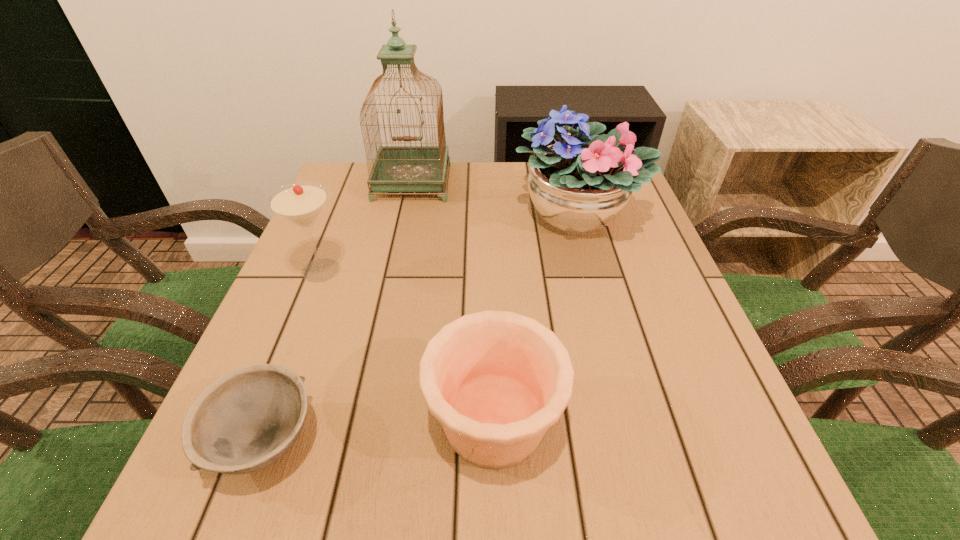
Identify the location of object that is at the far right corner. This screenshot has width=960, height=540. (579, 185).

Identify the location of free space at the far edge. (532, 201).

Identify the location of vacant area at the near edge of the desktop. The height and width of the screenshot is (540, 960). (561, 469).

Identify the location of vacant space at the left edge of the desktop. The height and width of the screenshot is (540, 960). (350, 246).

Where is `vacant space at the right edge of the desktop`? vacant space at the right edge of the desktop is located at coordinates (644, 366).

I want to click on free space at the far left corner of the desktop, so click(348, 186).

Image resolution: width=960 pixels, height=540 pixels. In the image, there is a desktop. Identify the location of vacant space at the near right corner. (684, 465).

Where is `free space that is in between the third tallest object and the shortest object`? This screenshot has width=960, height=540. free space that is in between the third tallest object and the shortest object is located at coordinates (293, 355).

You are a GUI agent. You are given a task and a screenshot of the screen. Output one action in this format:
    pyautogui.click(x=<x>, y=<y>)
    Task: Click on the free space between the second tallest object and the tallest object
    
    Given the screenshot: What is the action you would take?
    pyautogui.click(x=494, y=199)

The height and width of the screenshot is (540, 960). I want to click on vacant space that is in between the birdcage and the shortest object, so click(338, 311).